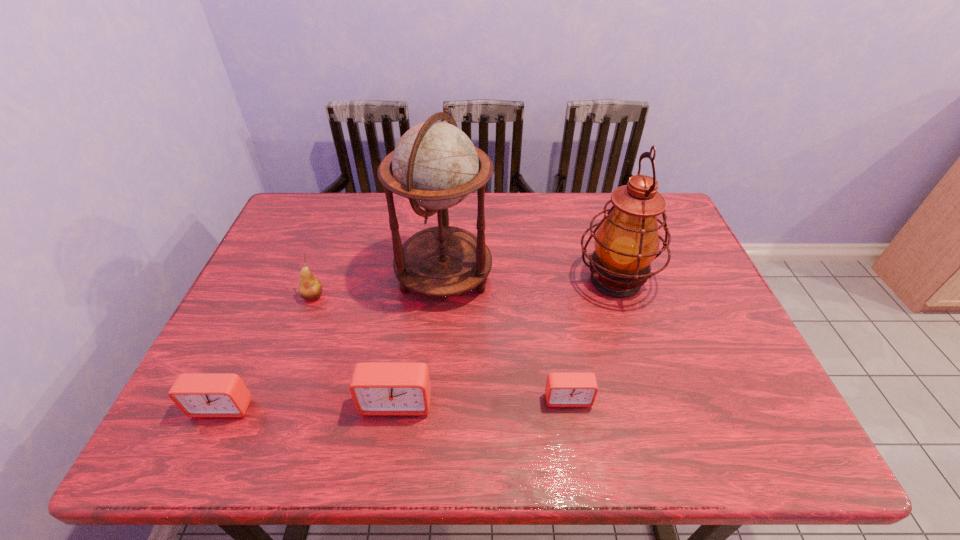
Locate an element on the screen. This screenshot has height=540, width=960. the leftmost alarm clock is located at coordinates (201, 395).

This screenshot has height=540, width=960. In order to click on the second shortest object in this screenshot , I will do `click(201, 395)`.

I want to click on the tallest alarm clock, so click(378, 388).

Find the location of a particular element. Image resolution: width=960 pixels, height=540 pixels. the shortest alarm clock is located at coordinates (562, 389).

In order to click on the second object from right to left in this screenshot , I will do `click(562, 389)`.

At what (x,y) coordinates should I click in order to perform the action: click on globe. Please return your answer as a coordinate pair (x, y). Looking at the image, I should click on (435, 165).

Where is `the rightmost object`? The image size is (960, 540). the rightmost object is located at coordinates (627, 241).

This screenshot has height=540, width=960. In order to click on pear in this screenshot , I will do `click(310, 288)`.

This screenshot has width=960, height=540. I want to click on free location located 0.170m on the surface of the globe, so click(x=552, y=276).

Find the location of `vacant space located on the left of the rightmost object`. vacant space located on the left of the rightmost object is located at coordinates (430, 280).